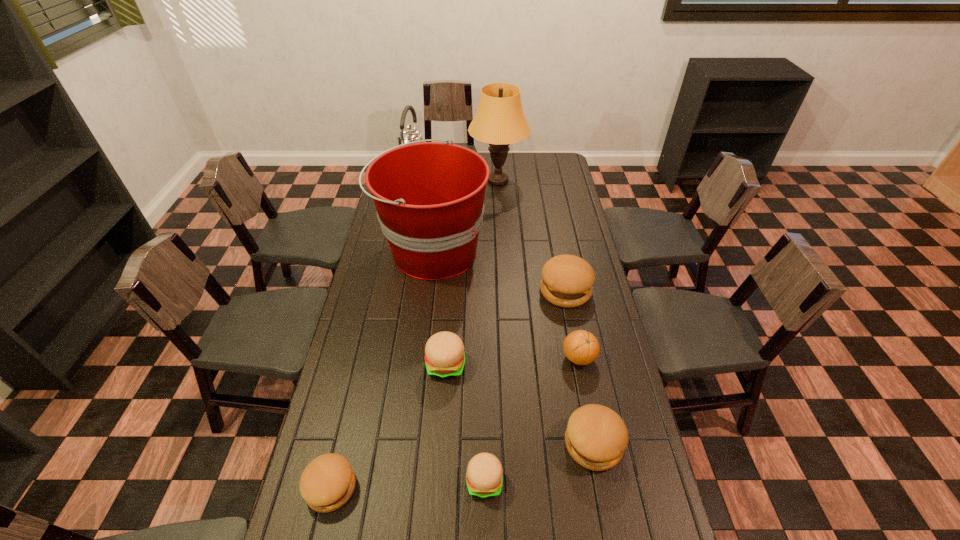
Locate an element on the screen. Image resolution: width=960 pixels, height=540 pixels. lampshade is located at coordinates (499, 121).

The height and width of the screenshot is (540, 960). What are the coordinates of `red bucket` in the screenshot? It's located at (429, 196).

The height and width of the screenshot is (540, 960). In order to click on kettle in this screenshot , I will do `click(409, 134)`.

Locate an element on the screen. Image resolution: width=960 pixels, height=540 pixels. the biggest brown hamburger is located at coordinates (567, 281).

Find the location of a particular element. This screenshot has width=960, height=540. the farthest hamburger is located at coordinates (567, 281).

Find the location of a particular element. The width and height of the screenshot is (960, 540). the bigger beige hamburger is located at coordinates (444, 352).

At what (x,y) coordinates should I click in order to perform the action: click on the second farthest hamburger. Please return your answer as a coordinate pair (x, y). This screenshot has height=540, width=960. Looking at the image, I should click on (444, 352).

At what (x,y) coordinates should I click in order to perform the action: click on orange orange. Please return your answer as a coordinate pair (x, y). Looking at the image, I should click on (581, 347).

The image size is (960, 540). Identify the location of the second biggest brown hamburger. (596, 437).

Where is `the leftmost hamburger`? The height and width of the screenshot is (540, 960). the leftmost hamburger is located at coordinates (328, 481).